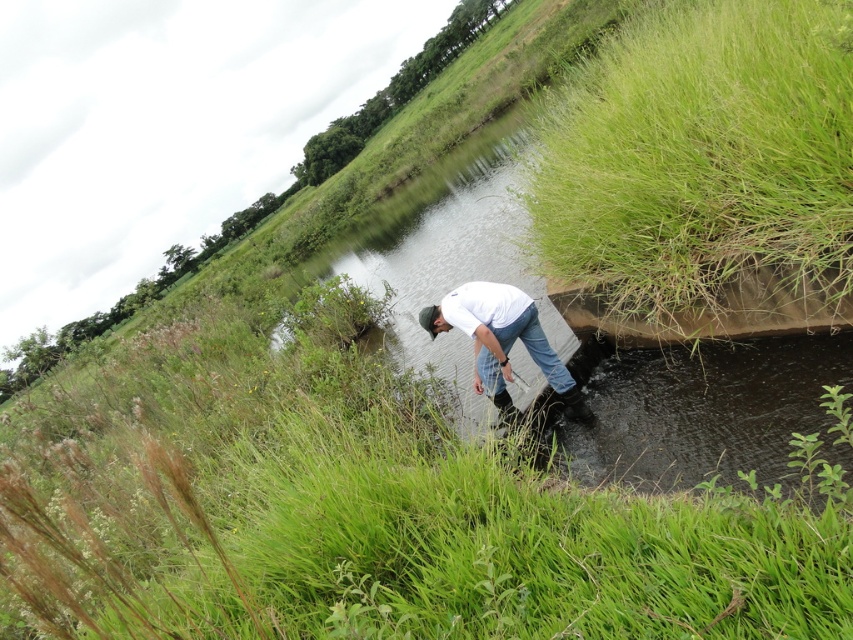
Is white matte shirt at center bigger than blue denim jeans at lower center?

Correct, white matte shirt at center is larger in size than blue denim jeans at lower center.

Who is more forward, (541,369) or (495,364)?

Positioned in front is point (495,364).

Is point (480, 344) positioned after point (541, 340)?

No, (480, 344) is closer to viewer.

I want to click on white matte shirt at center, so click(502, 342).

Is green grassy bank at upper right smaller than blue denim jeans at lower center?

No.

Image resolution: width=853 pixels, height=640 pixels. I want to click on green grassy bank at upper right, so click(x=701, y=176).

Does green grassy bank at upper right have a smaller size compared to white matte shirt at center?

No.

Which is more to the right, green grassy bank at upper right or white matte shirt at center?

From the viewer's perspective, green grassy bank at upper right appears more on the right side.

Where is `green grassy bank at upper right`? green grassy bank at upper right is located at coordinates (701, 176).

The width and height of the screenshot is (853, 640). Identify the location of green grassy bank at upper right. (701, 176).